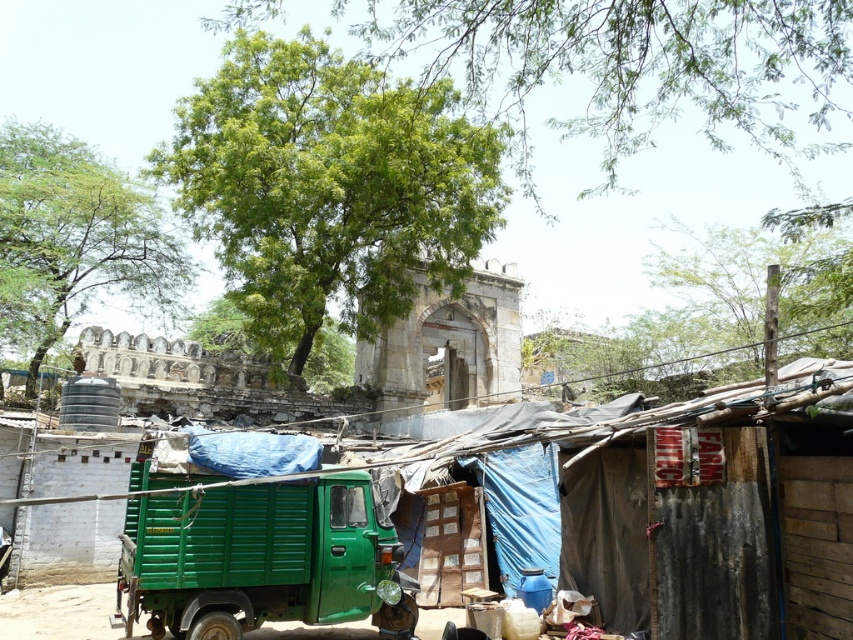
Is green matte truck at center to the right of stone archway at center from the viewer's perspective?

No, green matte truck at center is not to the right of stone archway at center.

Can you confirm if green matte truck at center is bigger than stone archway at center?

Actually, green matte truck at center might be smaller than stone archway at center.

What do you see at coordinates (262, 557) in the screenshot? The width and height of the screenshot is (853, 640). I see `green matte truck at center` at bounding box center [262, 557].

This screenshot has height=640, width=853. In order to click on green matte truck at center in this screenshot , I will do `click(262, 557)`.

Can you confirm if green leafy tree at center is bigger than green matte truck at center?

Yes, green leafy tree at center is bigger than green matte truck at center.

Is point (215, 154) less distant than point (372, 557)?

That is False.

Is point (363, 90) positioned after point (157, 628)?

That is True.

Image resolution: width=853 pixels, height=640 pixels. I want to click on green leafy tree at center, so click(x=328, y=188).

Between green leafy tree at center and green leafy tree at upper center, which one appears on the right side from the viewer's perspective?

green leafy tree at upper center

Between green leafy tree at center and green leafy tree at upper center, which one has more height?

green leafy tree at upper center is taller.

Who is more distant from viewer, (379,141) or (741,81)?

The point (379,141) is more distant.

Locate an element on the screen. green leafy tree at center is located at coordinates (328, 188).